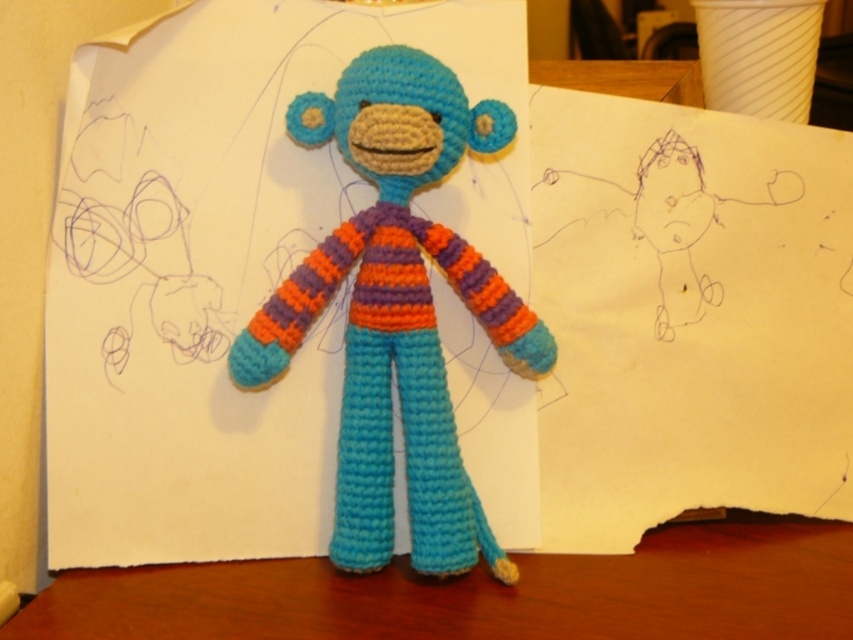
You are standing 5 feet away from the wooden surface where the crocheted monkey toy is placed. If you want to reach the point at coordinates point (x=344, y=390), will you be able to do so without moving closer?

The distance of point (x=344, y=390) from viewer is 4.43 feet, so since you are currently 5 feet away, you need to move 0.57 feet closer to reach it.

You are a toy designer who needs to place a sticker on the knitted yarn monkey at center. According to the coordinates provided, where should you place the sticker on the monkey?

The sticker should be placed at the 2D location coordinates of point (397, 310) on the knitted yarn monkey at center.

You are organizing a childrens birthday party and need to place a cake on the wooden table at center. The knitted yarn monkey at center is currently in the way. Can you move the monkey to the right side of the table to make space?

The knitted yarn monkey at center is currently on the left side of wooden table at center. Moving it to the right side would free up space on the left for placing the cake.